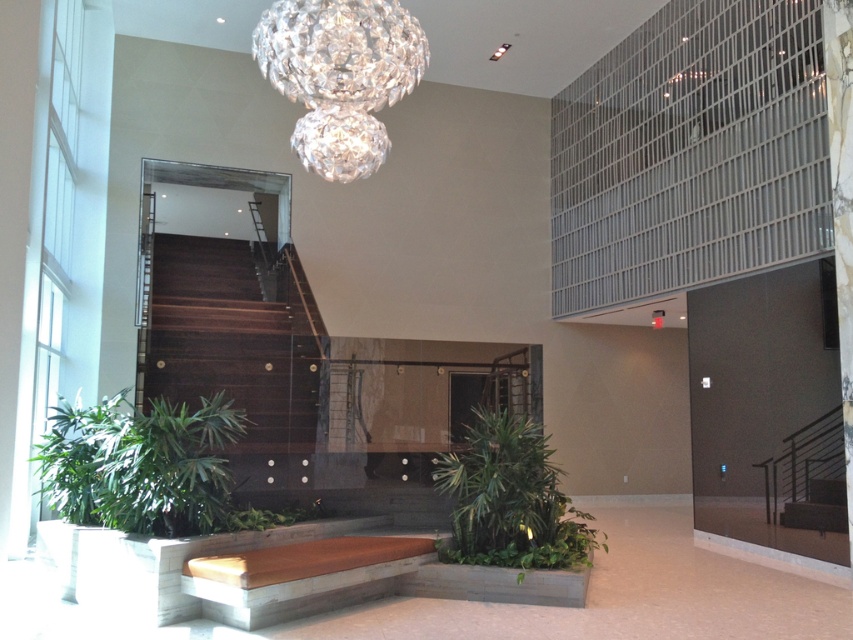
Is point (293, 74) farther from viewer compared to point (554, 500)?

No, (293, 74) is closer to viewer.

Is point (291, 52) in front of point (561, 492)?

Yes, it is in front of point (561, 492).

Locate an element on the screen. The image size is (853, 640). crystal glass chandelier at upper center is located at coordinates (340, 76).

Image resolution: width=853 pixels, height=640 pixels. I want to click on crystal glass chandelier at upper center, so click(x=340, y=76).

Describe the element at coordinates (140, 465) in the screenshot. Image resolution: width=853 pixels, height=640 pixels. I see `green leafy plant at lower left` at that location.

Does green leafy plant at lower left have a lesser width compared to green leafy plant at center?

No, green leafy plant at lower left is not thinner than green leafy plant at center.

Locate an element on the screen. The height and width of the screenshot is (640, 853). green leafy plant at lower left is located at coordinates (140, 465).

Is green leafy plant at lower left positioned in front of crystal glass chandelier at upper center?

No, it is behind crystal glass chandelier at upper center.

Find the location of a particular element. Image resolution: width=853 pixels, height=640 pixels. green leafy plant at lower left is located at coordinates (140, 465).